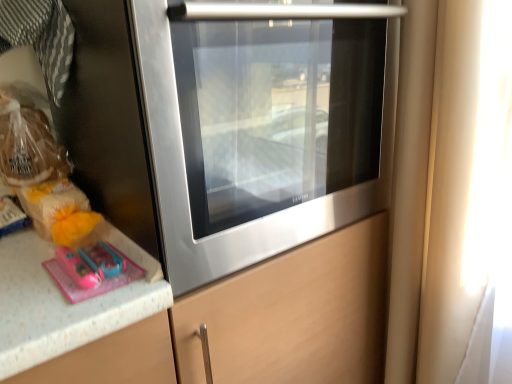
Question: Does transparent glass window at right appear on the left side of translucent plastic bread at left, the second food in the bottom-to-top sequence?

Choices:
 (A) yes
 (B) no

Answer: (B)

Question: Is transparent glass window at right positioned in front of translucent plastic bread at left, the second food in the bottom-to-top sequence?

Choices:
 (A) no
 (B) yes

Answer: (B)

Question: Is transparent glass window at right not near translucent plastic bread at left, marked as the first food in a top-to-bottom arrangement?

Choices:
 (A) no
 (B) yes

Answer: (A)

Question: Can you confirm if transparent glass window at right is positioned to the right of translucent plastic bread at left, marked as the first food in a top-to-bottom arrangement?

Choices:
 (A) no
 (B) yes

Answer: (B)

Question: From the image's perspective, would you say transparent glass window at right is shown under translucent plastic bread at left, the second food in the bottom-to-top sequence?

Choices:
 (A) no
 (B) yes

Answer: (B)

Question: Is transparent glass window at right behind translucent plastic bread at left, the second food in the bottom-to-top sequence?

Choices:
 (A) yes
 (B) no

Answer: (B)

Question: Is stainless steel oven at center smaller than translucent plastic bread at left, marked as the first food in a top-to-bottom arrangement?

Choices:
 (A) no
 (B) yes

Answer: (A)

Question: Is translucent plastic bread at left, the second food in the bottom-to-top sequence, surrounded by stainless steel oven at center?

Choices:
 (A) yes
 (B) no

Answer: (B)

Question: Could you tell me if stainless steel oven at center is facing translucent plastic bread at left, marked as the first food in a top-to-bottom arrangement?

Choices:
 (A) yes
 (B) no

Answer: (B)

Question: Is stainless steel oven at center oriented away from translucent plastic bread at left, marked as the first food in a top-to-bottom arrangement?

Choices:
 (A) yes
 (B) no

Answer: (B)

Question: From a real-world perspective, is stainless steel oven at center located beneath translucent plastic bread at left, the second food in the bottom-to-top sequence?

Choices:
 (A) yes
 (B) no

Answer: (B)

Question: Considering the relative sizes of stainless steel oven at center and translucent plastic bread at left, the second food in the bottom-to-top sequence, in the image provided, is stainless steel oven at center wider than translucent plastic bread at left, the second food in the bottom-to-top sequence,?

Choices:
 (A) no
 (B) yes

Answer: (B)

Question: From a real-world perspective, is translucent plastic bread at left, the second food in the bottom-to-top sequence, under transparent glass window at right?

Choices:
 (A) yes
 (B) no

Answer: (B)